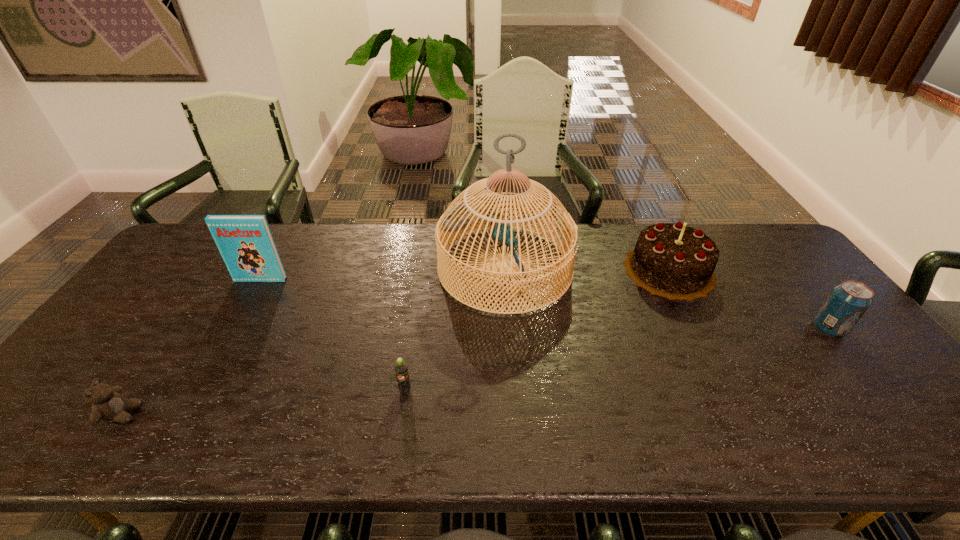
The width and height of the screenshot is (960, 540). Find the location of `object positioned at the near edge`. object positioned at the near edge is located at coordinates (108, 404).

At what (x,y) coordinates should I click in order to perform the action: click on object that is at the left edge. Please return your answer as a coordinate pair (x, y). Looking at the image, I should click on (108, 404).

Where is `object that is at the right edge`? The image size is (960, 540). object that is at the right edge is located at coordinates [x=848, y=301].

You are a GUI agent. You are given a task and a screenshot of the screen. Output one action in this format:
    pyautogui.click(x=<x>, y=<y>)
    Task: Click on the object that is at the near left corner
    The image size is (960, 540).
    Given the screenshot: What is the action you would take?
    pyautogui.click(x=108, y=404)

In order to click on free space at the far edge of the desktop in this screenshot , I will do `click(327, 248)`.

Locate an element on the screen. free space at the near edge of the desktop is located at coordinates (234, 416).

You are a GUI agent. You are given a task and a screenshot of the screen. Output one action in this format:
    pyautogui.click(x=<x>, y=<y>)
    Task: Click on the vacant space at the left edge
    The height and width of the screenshot is (540, 960).
    Given the screenshot: What is the action you would take?
    pyautogui.click(x=128, y=335)

Where is `vacant space at the right edge of the desktop`? The image size is (960, 540). vacant space at the right edge of the desktop is located at coordinates (840, 340).

At what (x,y) coordinates should I click in order to perform the action: click on vacant space at the far left corner of the desktop. Please return your answer as a coordinate pair (x, y). The image size is (960, 540). Looking at the image, I should click on 196,267.

Find the location of a particular element. vacant space at the near left corner of the desktop is located at coordinates (51, 444).